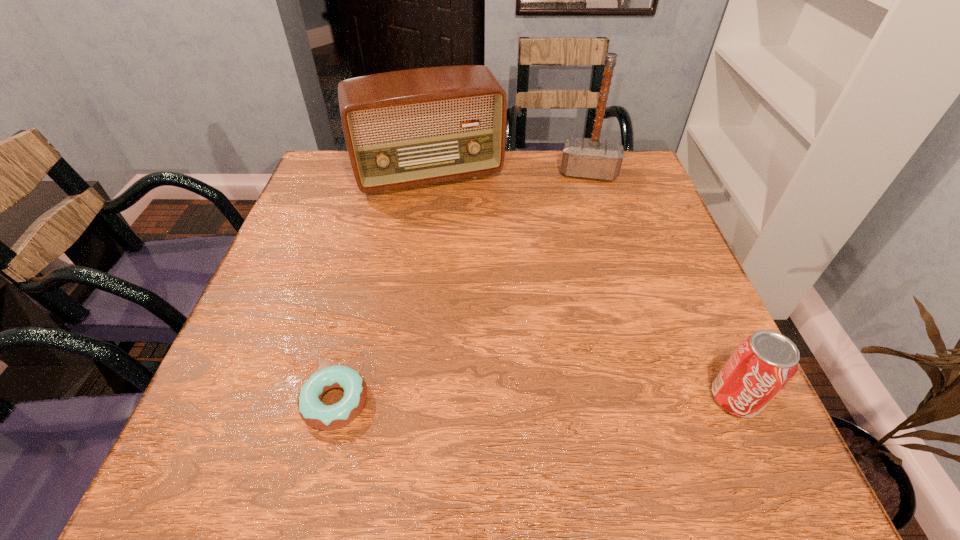
Find the location of a particular element. soda can at the right edge is located at coordinates (763, 363).

I want to click on hammer present at the right edge, so click(x=582, y=157).

Locate an element on the screen. Image resolution: width=960 pixels, height=540 pixels. object at the far left corner is located at coordinates (405, 128).

Image resolution: width=960 pixels, height=540 pixels. What are the coordinates of `object positioned at the near left corner` in the screenshot? It's located at (311, 409).

Identify the location of object at the far right corner. The width and height of the screenshot is (960, 540). (582, 157).

Locate an element on the screen. The width and height of the screenshot is (960, 540). object present at the near right corner is located at coordinates (763, 363).

The image size is (960, 540). Find the location of `vacant space at the far edge of the desktop`. vacant space at the far edge of the desktop is located at coordinates (393, 193).

You are a GUI agent. You are given a task and a screenshot of the screen. Output one action in this format:
    pyautogui.click(x=<x>, y=<y>)
    Task: Click on the free space at the near edge of the desktop
    
    Given the screenshot: What is the action you would take?
    pyautogui.click(x=564, y=419)

The width and height of the screenshot is (960, 540). In the image, there is a desktop. In order to click on vacant region at the left edge in this screenshot , I will do [x=322, y=256].

Find the location of `vacant space at the right edge of the desktop`. vacant space at the right edge of the desktop is located at coordinates (633, 285).